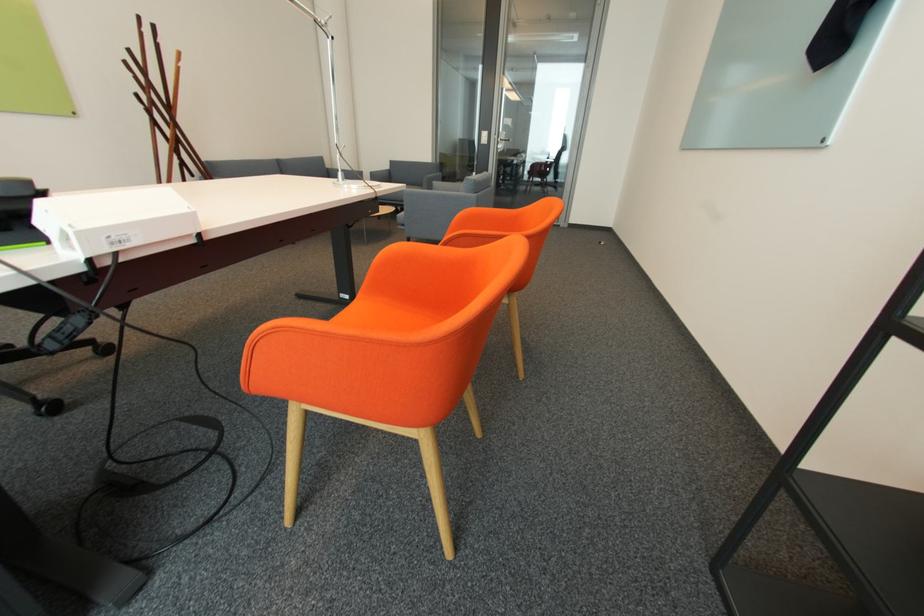
Describe the element at coordinates (379, 315) in the screenshot. The image size is (924, 616). I see `a orange chair sitting surface` at that location.